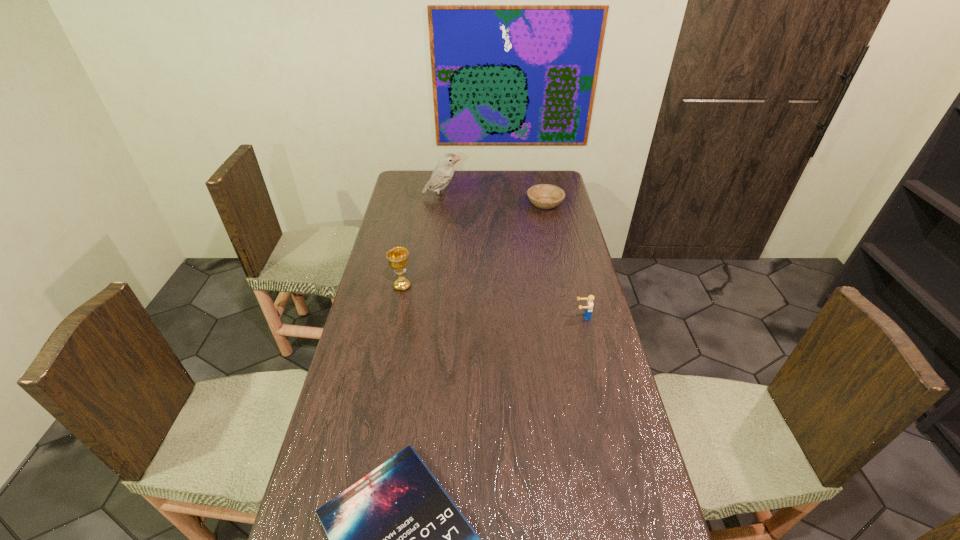
The width and height of the screenshot is (960, 540). Find the location of `the tallest object`. the tallest object is located at coordinates (444, 171).

At what (x,y) coordinates should I click in order to perform the action: click on the third farthest object. Please return your answer as a coordinate pair (x, y). Looking at the image, I should click on (398, 259).

Identify the location of chalice. (398, 259).

At what (x,y) coordinates should I click in order to perform the action: click on the second nearest object. Please return your answer as a coordinate pair (x, y). Looking at the image, I should click on (589, 304).

Identify the location of Lego. (589, 304).

What are the coordinates of `the second shortest object` in the screenshot? It's located at (544, 196).

At what (x,y) coordinates should I click in order to perform the action: click on vacant space situated 0.240m at the face of the tallest object. Please return your answer as a coordinate pair (x, y). This screenshot has width=960, height=540. Looking at the image, I should click on (513, 197).

Image resolution: width=960 pixels, height=540 pixels. I want to click on free space located on the right of the chalice, so click(x=429, y=286).

Find the location of a particular element. free region located 0.370m on the face of the Lego is located at coordinates (467, 316).

This screenshot has width=960, height=540. Identify the location of free spot located on the face of the Lego. (458, 316).